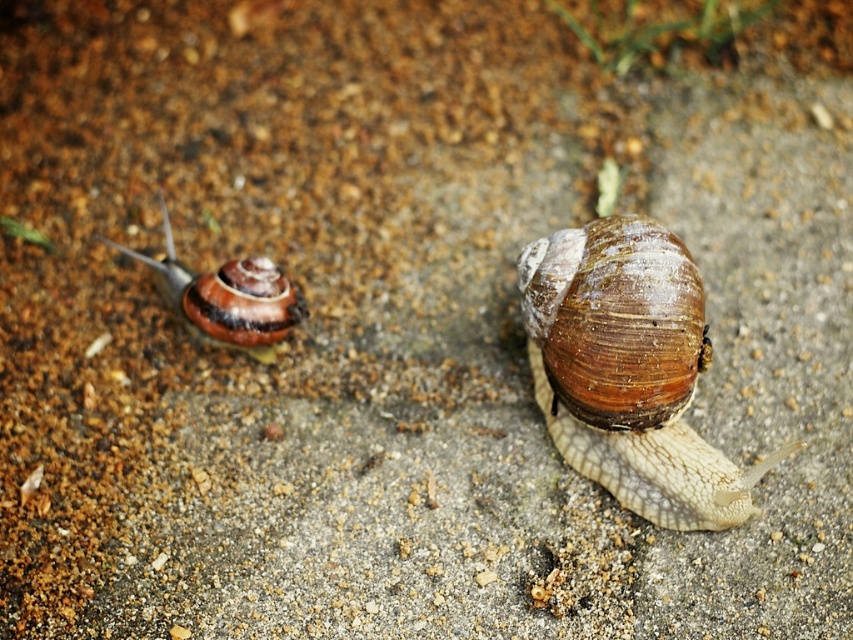
Is brown shiny shell at center above shiny brown shell at left?

Actually, brown shiny shell at center is below shiny brown shell at left.

Who is more distant from viewer, [618,230] or [241,307]?

Positioned behind is point [241,307].

The height and width of the screenshot is (640, 853). What are the coordinates of `brown shiny shell at center` in the screenshot? It's located at (628, 369).

At what (x,y) coordinates should I click in order to perform the action: click on brown shiny shell at center. Please return your answer as a coordinate pair (x, y). The width and height of the screenshot is (853, 640). Looking at the image, I should click on (628, 369).